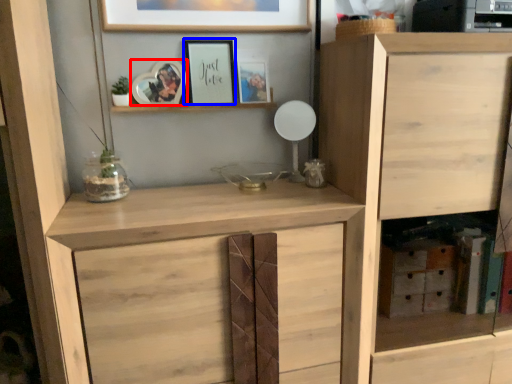
Question: Which object is further to the camera taking this photo, picture frame (highlighted by a red box) or picture frame (highlighted by a blue box)?

Choices:
 (A) picture frame
 (B) picture frame

Answer: (B)